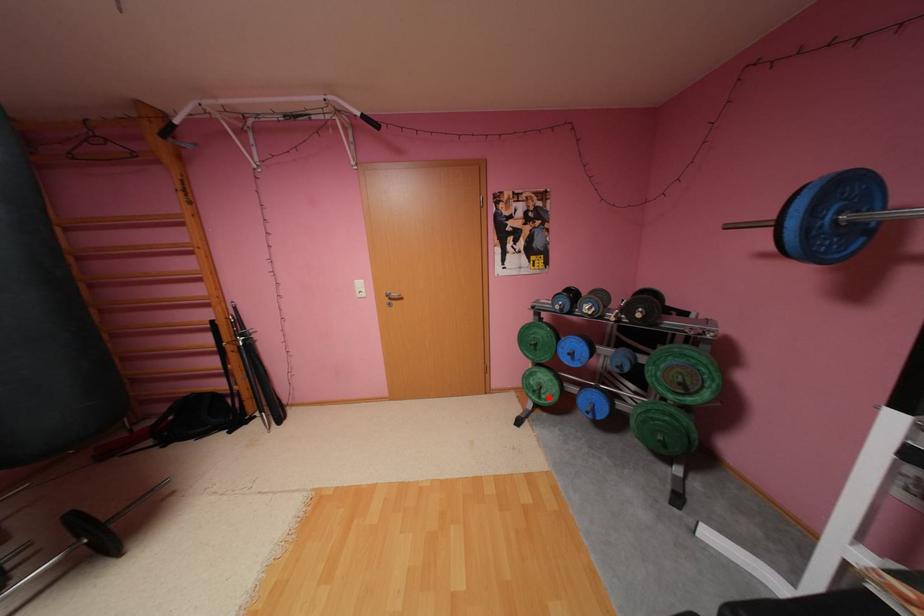
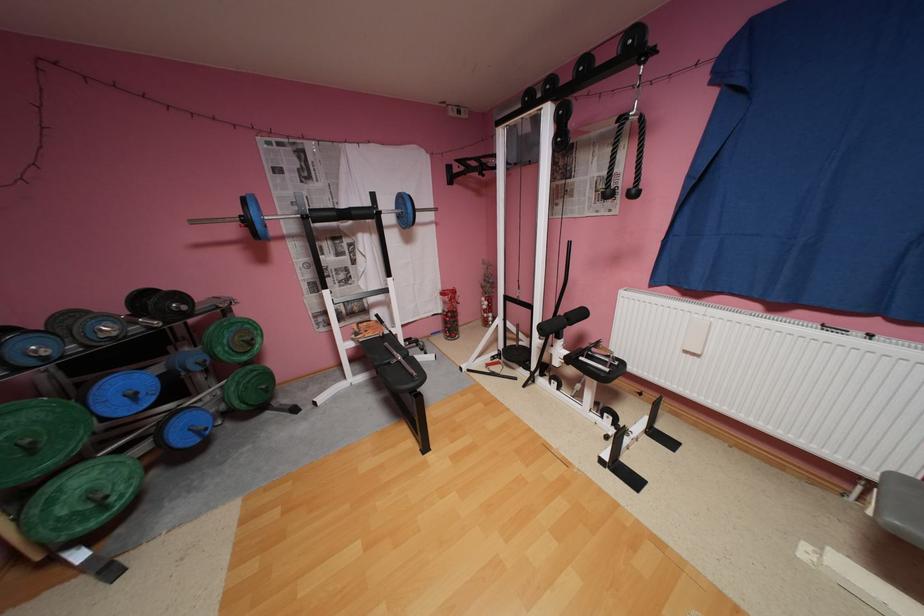
Question: I am providing you with two images of the same scene from different viewpoints. Given a red point in image1, look at the same physical point in image2. Is it:

Choices:
 (A) Closer to the viewpoint
 (B) Farther from the viewpoint

Answer: (A)